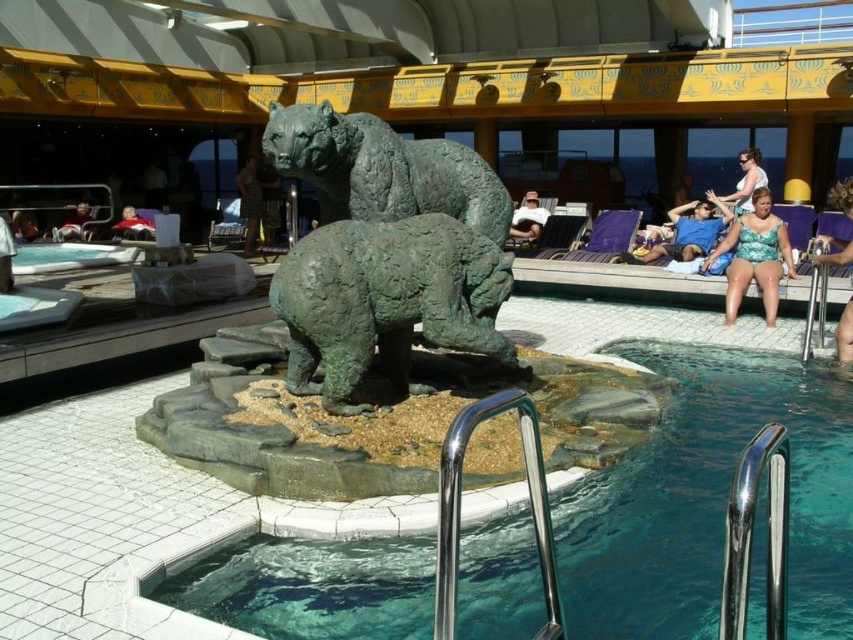
Is green patina bear at center closer to the viewer compared to matte black shirt at upper left?

Yes, it is in front of matte black shirt at upper left.

Is green patina bear at center below matte black shirt at upper left?

Yes.

Does point (436, 260) come in front of point (86, 216)?

Yes, point (436, 260) is in front of point (86, 216).

At what (x,y) coordinates should I click in order to perform the action: click on green patina bear at center. Please return your answer as a coordinate pair (x, y). Image resolution: width=853 pixels, height=640 pixels. Looking at the image, I should click on (386, 300).

Is teal glassy water at center below green textured swimsuit at right?

Correct, teal glassy water at center is located below green textured swimsuit at right.

Is teal glassy water at center behind green textured swimsuit at right?

No, it is in front of green textured swimsuit at right.

Which is in front, point (695, 531) or point (737, 240)?

Point (695, 531)

Find the location of `teal glassy water at center`. teal glassy water at center is located at coordinates (711, 499).

Identify the location of green patina bear at center. (386, 300).

At what (x,y) coordinates should I click in order to perform the action: click on green patina bear at center. Please return your answer as a coordinate pair (x, y). This screenshot has width=853, height=640. Looking at the image, I should click on (386, 300).